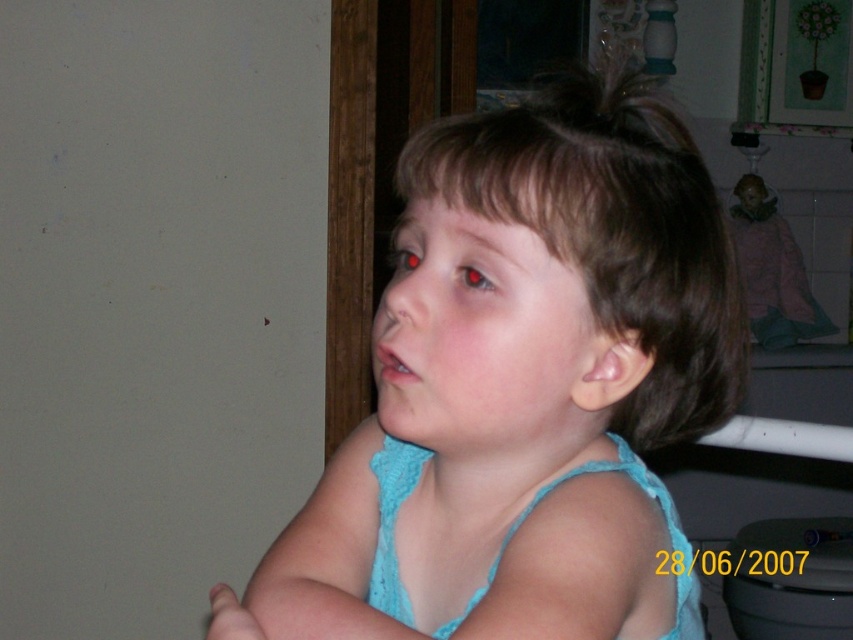
Can you confirm if light blue fabric at center is wider than brown smooth hair at center?

Indeed, light blue fabric at center has a greater width compared to brown smooth hair at center.

Can you confirm if light blue fabric at center is taller than brown smooth hair at center?

Correct, light blue fabric at center is much taller as brown smooth hair at center.

Identify the location of light blue fabric at center. This screenshot has height=640, width=853. (521, 384).